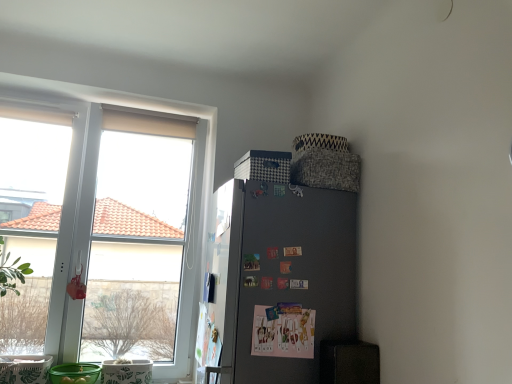
Question: Can you confirm if satin black fridge at right is positioned to the right of white matte window at upper left?

Choices:
 (A) no
 (B) yes

Answer: (B)

Question: Can you confirm if satin black fridge at right is smaller than white matte window at upper left?

Choices:
 (A) no
 (B) yes

Answer: (B)

Question: Is the position of satin black fridge at right more distant than that of white matte window at upper left?

Choices:
 (A) yes
 (B) no

Answer: (B)

Question: Can you confirm if satin black fridge at right is shorter than white matte window at upper left?

Choices:
 (A) no
 (B) yes

Answer: (B)

Question: Considering the relative sizes of satin black fridge at right and white matte window at upper left in the image provided, is satin black fridge at right taller than white matte window at upper left?

Choices:
 (A) yes
 (B) no

Answer: (B)

Question: Does satin black fridge at right lie in front of white matte window at upper left?

Choices:
 (A) no
 (B) yes

Answer: (B)

Question: From the image's perspective, is white matte window at upper left below satin black fridge at right?

Choices:
 (A) yes
 (B) no

Answer: (B)

Question: From a real-world perspective, is white matte window at upper left positioned under satin black fridge at right based on gravity?

Choices:
 (A) no
 (B) yes

Answer: (A)

Question: Could satin black fridge at right be considered to be inside white matte window at upper left?

Choices:
 (A) no
 (B) yes

Answer: (A)

Question: Is white matte window at upper left turned away from satin black fridge at right?

Choices:
 (A) yes
 (B) no

Answer: (B)

Question: Can you confirm if white matte window at upper left is smaller than satin black fridge at right?

Choices:
 (A) yes
 (B) no

Answer: (B)

Question: From a real-world perspective, is white matte window at upper left on top of satin black fridge at right?

Choices:
 (A) no
 (B) yes

Answer: (B)

Question: Is point (35, 84) closer or farther from the camera than point (208, 357)?

Choices:
 (A) farther
 (B) closer

Answer: (A)